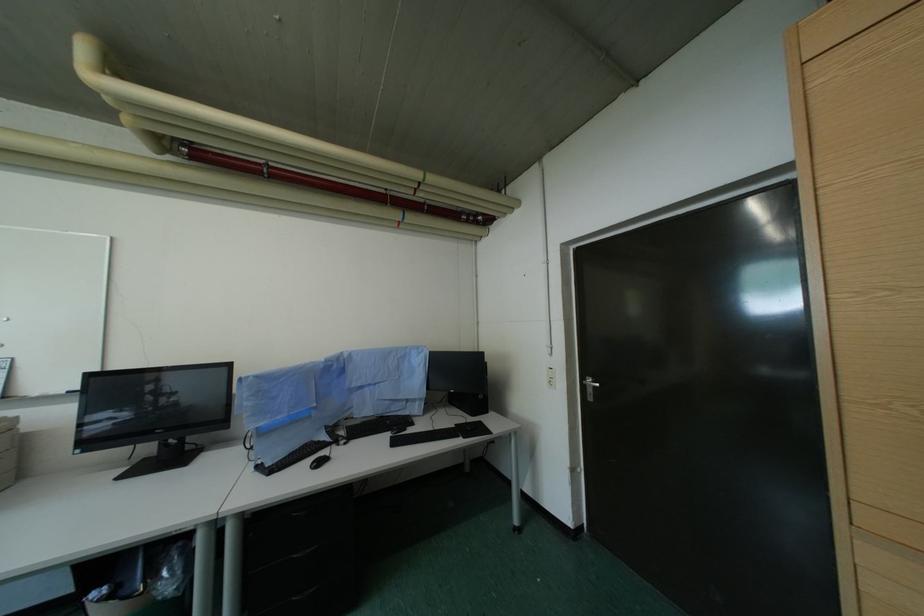
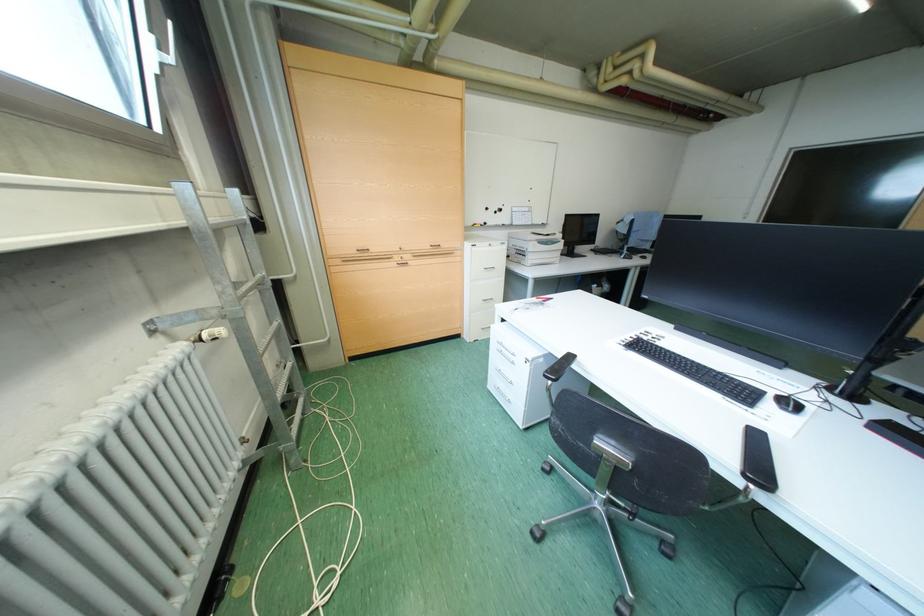
The images are taken continuously from a first-person perspective. In which direction are you moving?

The cameraman walked toward left, backward.